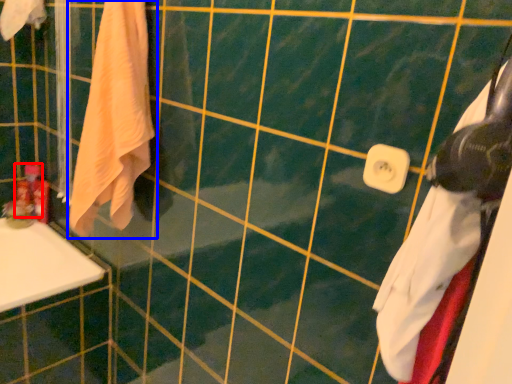
Question: Which of the following is the farthest to the observer, toiletry (highlighted by a red box) or towel (highlighted by a blue box)?

Choices:
 (A) toiletry
 (B) towel

Answer: (A)